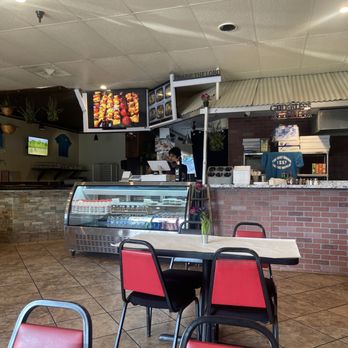
This screenshot has width=348, height=348. I want to click on table top flower, so click(204, 233).